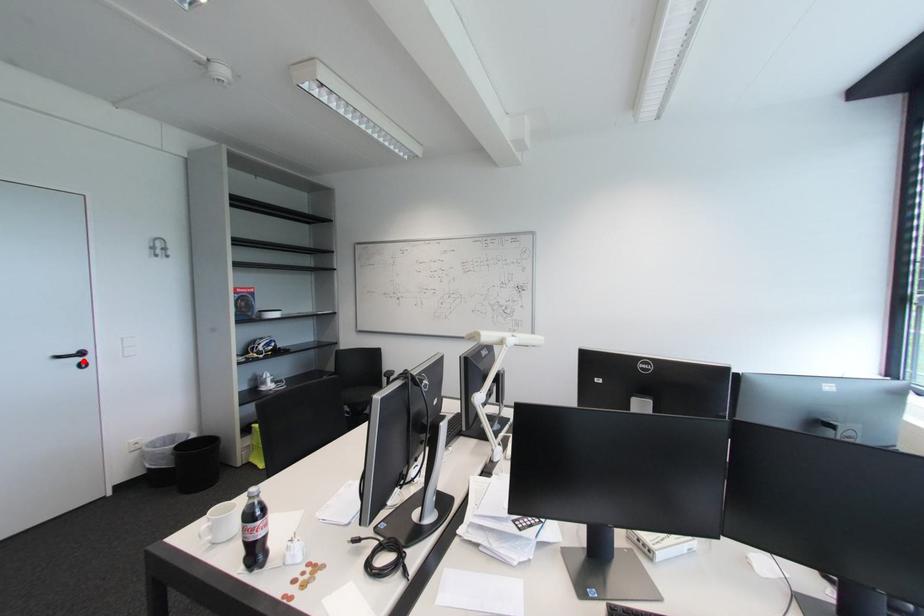
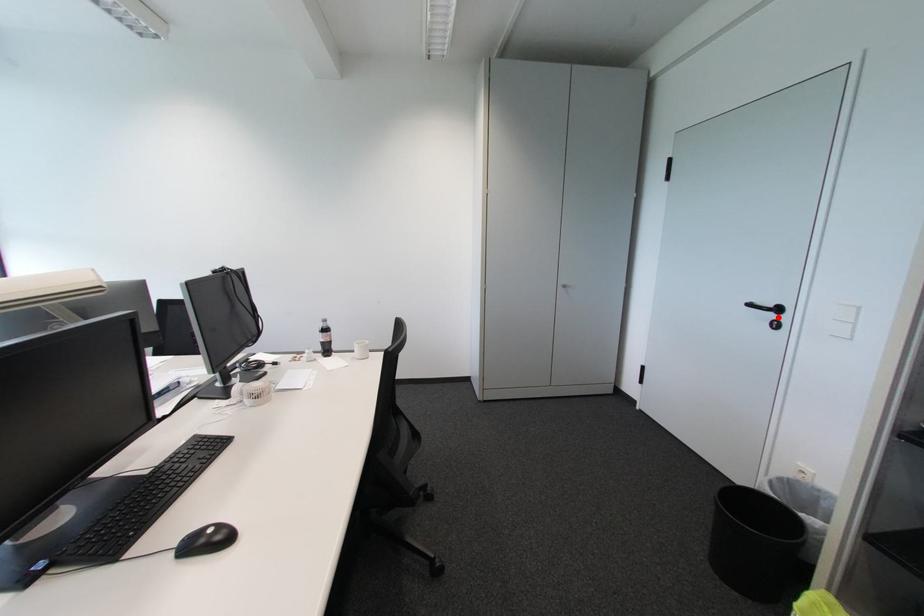
I am providing you with two images of the same scene from different viewpoints. A red point is marked on the first image and another point is marked on the second image. Does the point marked in image1 correspond to the same location as the one in image2?

Yes